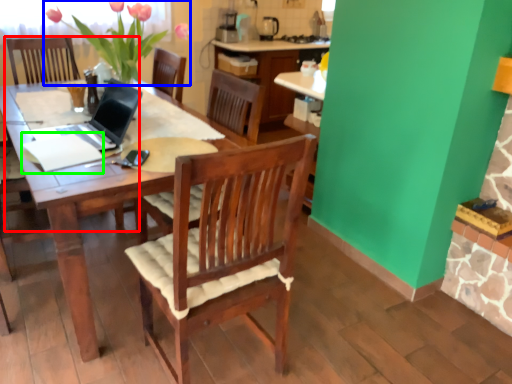
Question: Which object is the farthest from armchair (highlighted by a red box)? Choose among these: floral arrangement (highlighted by a blue box) or notepad (highlighted by a green box).

Choices:
 (A) floral arrangement
 (B) notepad

Answer: (B)